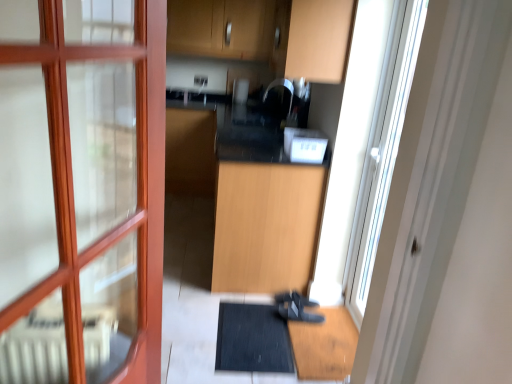
Question: From the image's perspective, is light wood cabinet at center, the first cabinetry when ordered from bottom to top, located beneath black rubber bath mat at lower center?

Choices:
 (A) yes
 (B) no

Answer: (B)

Question: Is light wood cabinet at center, the first cabinetry when ordered from bottom to top, positioned in front of black rubber bath mat at lower center?

Choices:
 (A) yes
 (B) no

Answer: (B)

Question: Can you confirm if light wood cabinet at center, which is the second cabinetry from top to bottom, is shorter than black rubber bath mat at lower center?

Choices:
 (A) no
 (B) yes

Answer: (A)

Question: Does light wood cabinet at center, the first cabinetry when ordered from bottom to top, come behind black rubber bath mat at lower center?

Choices:
 (A) yes
 (B) no

Answer: (A)

Question: Could black rubber bath mat at lower center be considered to be inside light wood cabinet at center, which is the second cabinetry from top to bottom?

Choices:
 (A) yes
 (B) no

Answer: (B)

Question: In terms of height, does white plastic toaster at center look taller or shorter compared to black rubber bath mat at lower center?

Choices:
 (A) tall
 (B) short

Answer: (A)

Question: Considering the relative positions of white plastic toaster at center and black rubber bath mat at lower center in the image provided, is white plastic toaster at center to the left or to the right of black rubber bath mat at lower center?

Choices:
 (A) right
 (B) left

Answer: (A)

Question: From a real-world perspective, is white plastic toaster at center physically located above or below black rubber bath mat at lower center?

Choices:
 (A) below
 (B) above

Answer: (B)

Question: Do you think white plastic toaster at center is within black rubber bath mat at lower center, or outside of it?

Choices:
 (A) inside
 (B) outside

Answer: (B)

Question: In terms of width, does white plastic toaster at center look wider or thinner when compared to wooden cabinet at upper center, acting as the first cabinetry starting from the top?

Choices:
 (A) thin
 (B) wide

Answer: (A)

Question: From the image's perspective, is white plastic toaster at center positioned above or below wooden cabinet at upper center, acting as the first cabinetry starting from the top?

Choices:
 (A) below
 (B) above

Answer: (A)

Question: Is point (297, 132) positioned closer to the camera than point (311, 59)?

Choices:
 (A) closer
 (B) farther

Answer: (B)

Question: Considering their positions, is white plastic toaster at center located in front of or behind wooden cabinet at upper center, arranged as the second cabinetry when ordered from the bottom?

Choices:
 (A) front
 (B) behind

Answer: (B)

Question: Is black rubber bath mat at lower center in front of or behind wooden cabinet at upper center, acting as the first cabinetry starting from the top, in the image?

Choices:
 (A) behind
 (B) front

Answer: (A)

Question: Considering the positions of black rubber bath mat at lower center and wooden cabinet at upper center, arranged as the second cabinetry when ordered from the bottom, in the image, is black rubber bath mat at lower center taller or shorter than wooden cabinet at upper center, arranged as the second cabinetry when ordered from the bottom,?

Choices:
 (A) tall
 (B) short

Answer: (B)